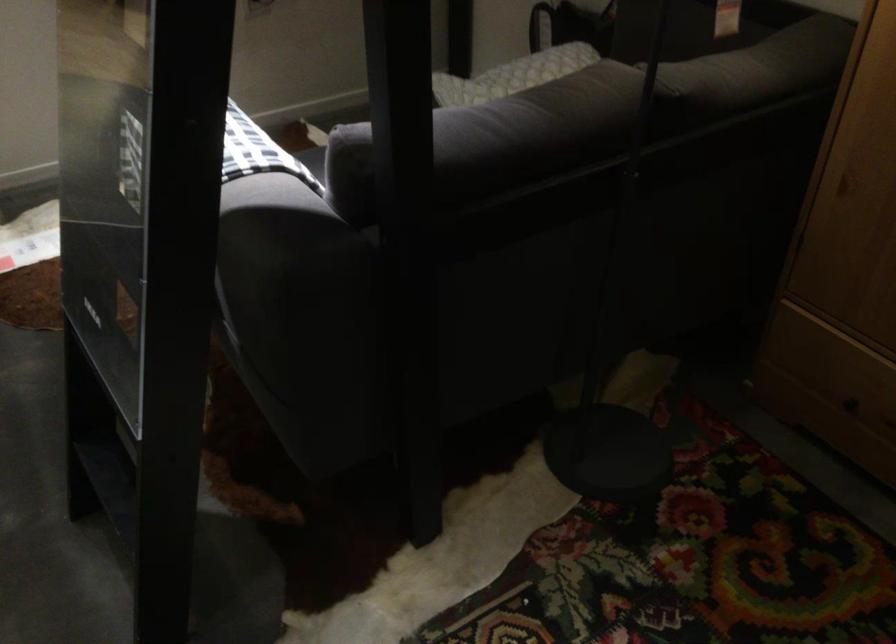
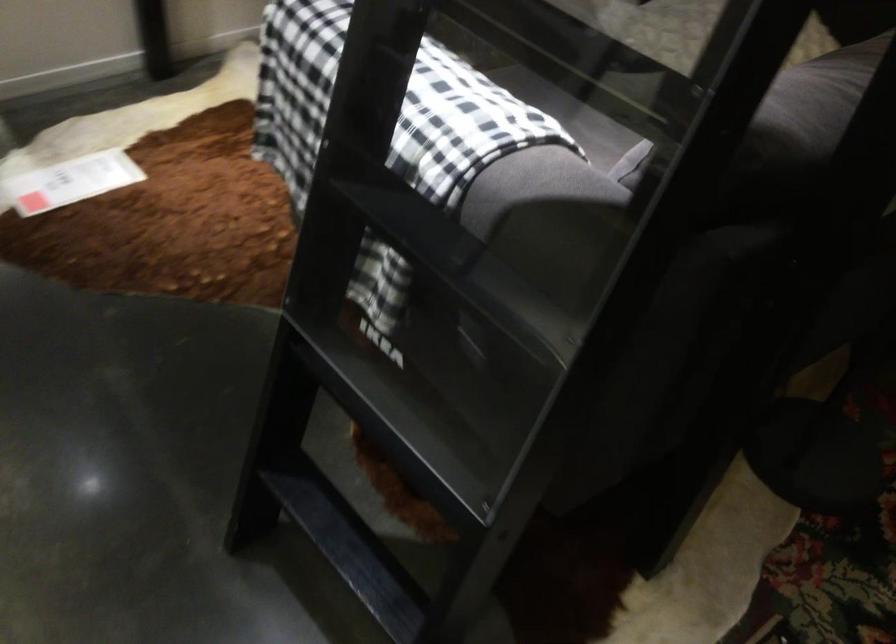
Consider the image. Which direction would the cameraman need to move to produce the second image?

The movement direction of the cameraman is left, forward.